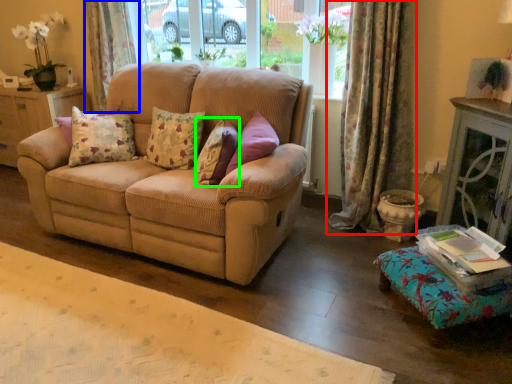
Question: Estimate the real-world distances between objects in this image. Which object is closer to curtain (highlighted by a red box), curtain (highlighted by a blue box) or pillow (highlighted by a green box)?

Choices:
 (A) curtain
 (B) pillow

Answer: (B)